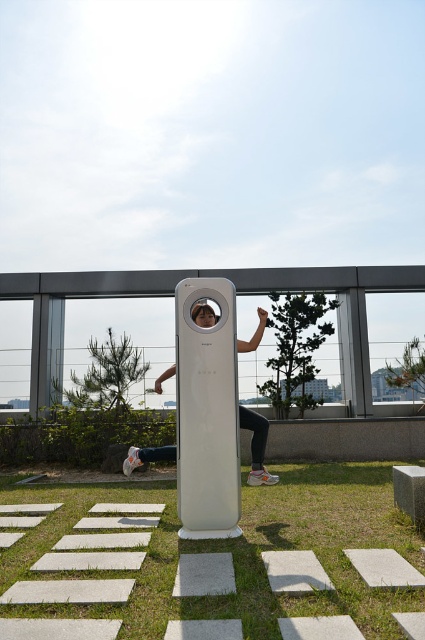
You are standing on the rooftop and see the green grass at lower center and the matte white pole at center. Which object is closer to the ground?

The green grass at lower center is closer to the ground as it is positioned below the matte white pole at center.

You are standing on the rooftop and want to walk to the green grass at lower center. Is the matte white pole at center blocking your path?

The green grass at lower center is in front of the matte white pole at center, so the pole is not blocking your path to the grass.